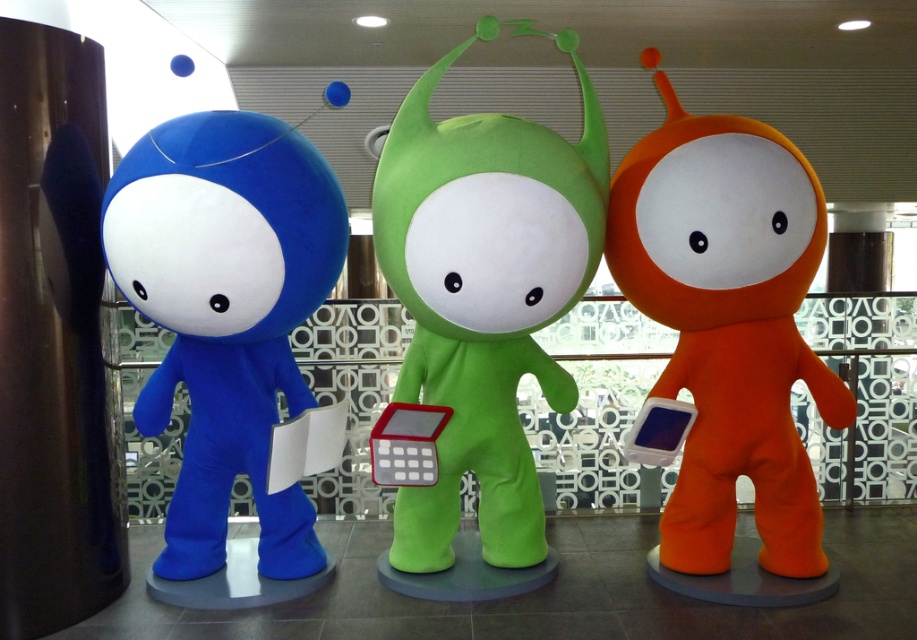
Question: Where is matte blue plush toy at left located in relation to orange soft plush toy at right in the image?

Choices:
 (A) left
 (B) right

Answer: (A)

Question: Is matte blue plush toy at left above orange soft plush toy at right?

Choices:
 (A) no
 (B) yes

Answer: (A)

Question: Among these objects, which one is farthest from the camera?

Choices:
 (A) orange soft plush toy at right
 (B) matte blue plush toy at left

Answer: (A)

Question: Is matte blue plush toy at left above orange soft plush toy at right?

Choices:
 (A) yes
 (B) no

Answer: (B)

Question: Which object is the closest to the green plush toy at center?

Choices:
 (A) orange soft plush toy at right
 (B) matte blue plush toy at left

Answer: (A)

Question: Estimate the real-world distances between objects in this image. Which object is closer to the orange soft plush toy at right?

Choices:
 (A) matte blue plush toy at left
 (B) green plush toy at center

Answer: (B)